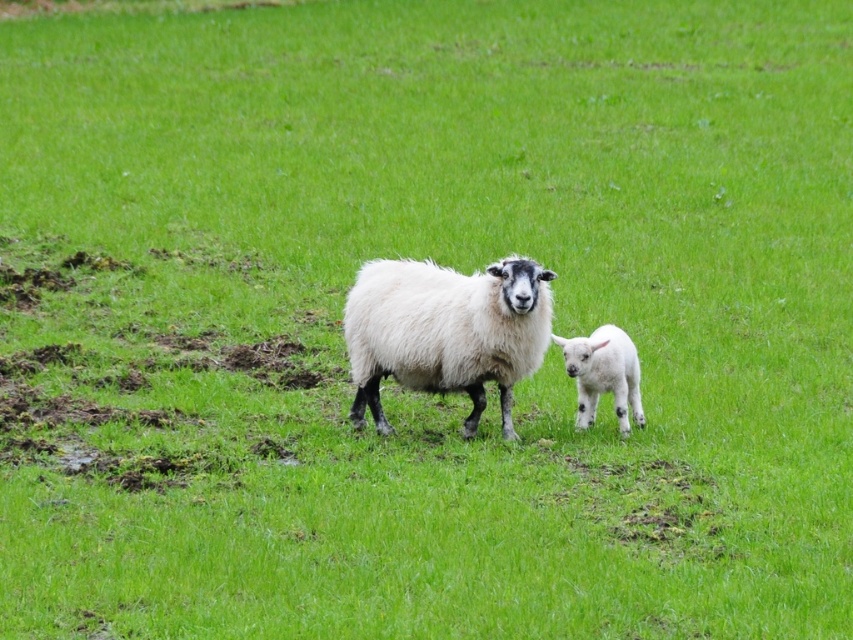
Question: Can you confirm if white woolly sheep at center is positioned to the right of white fluffy lamb at right?

Choices:
 (A) no
 (B) yes

Answer: (A)

Question: Which point appears closest to the camera in this image?

Choices:
 (A) (439, 314)
 (B) (577, 387)

Answer: (A)

Question: Does white woolly sheep at center lie behind white fluffy lamb at right?

Choices:
 (A) yes
 (B) no

Answer: (B)

Question: Which of the following is the closest to the observer?

Choices:
 (A) (422, 348)
 (B) (582, 355)

Answer: (A)

Question: Which point appears closest to the camera in this image?

Choices:
 (A) (578, 404)
 (B) (346, 305)

Answer: (B)

Question: Can you confirm if white woolly sheep at center is positioned to the right of white fluffy lamb at right?

Choices:
 (A) no
 (B) yes

Answer: (A)